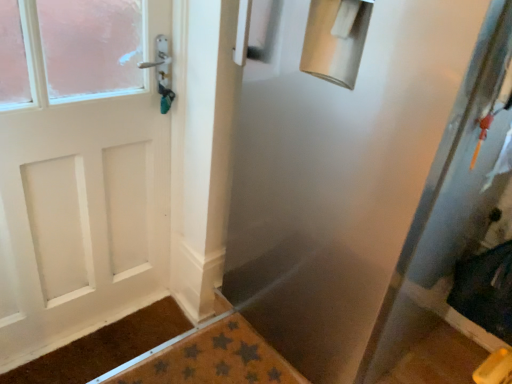
Question: Does transparent plastic screen door at center turn towards brown textured bath mat at lower center?

Choices:
 (A) no
 (B) yes

Answer: (A)

Question: From a real-world perspective, is transparent plastic screen door at center under brown textured bath mat at lower center?

Choices:
 (A) yes
 (B) no

Answer: (B)

Question: Is transparent plastic screen door at center in front of brown textured bath mat at lower center?

Choices:
 (A) no
 (B) yes

Answer: (B)

Question: Does transparent plastic screen door at center have a larger size compared to brown textured bath mat at lower center?

Choices:
 (A) no
 (B) yes

Answer: (B)

Question: Can you confirm if transparent plastic screen door at center is taller than brown textured bath mat at lower center?

Choices:
 (A) no
 (B) yes

Answer: (B)

Question: Considering the relative positions of transparent plastic screen door at center and brown textured mat at lower left in the image provided, is transparent plastic screen door at center to the left or to the right of brown textured mat at lower left?

Choices:
 (A) right
 (B) left

Answer: (A)

Question: Which is correct: transparent plastic screen door at center is inside brown textured mat at lower left, or outside of it?

Choices:
 (A) outside
 (B) inside

Answer: (A)

Question: Is transparent plastic screen door at center wider or thinner than brown textured mat at lower left?

Choices:
 (A) wide
 (B) thin

Answer: (A)

Question: Does point (305, 233) appear closer or farther from the camera than point (106, 359)?

Choices:
 (A) closer
 (B) farther

Answer: (A)

Question: Considering the positions of point (117, 357) and point (291, 374), is point (117, 357) closer or farther from the camera than point (291, 374)?

Choices:
 (A) closer
 (B) farther

Answer: (B)

Question: From a real-world perspective, is brown textured mat at lower left positioned above or below brown textured bath mat at lower center?

Choices:
 (A) above
 (B) below

Answer: (B)

Question: In terms of size, does brown textured mat at lower left appear bigger or smaller than brown textured bath mat at lower center?

Choices:
 (A) small
 (B) big

Answer: (A)

Question: In the image, is brown textured mat at lower left on the left side or the right side of brown textured bath mat at lower center?

Choices:
 (A) right
 (B) left

Answer: (B)

Question: Looking at their shapes, would you say transparent plastic screen door at center is wider or thinner than brown textured bath mat at lower center?

Choices:
 (A) thin
 (B) wide

Answer: (B)

Question: Considering the relative positions of transparent plastic screen door at center and brown textured bath mat at lower center in the image provided, is transparent plastic screen door at center to the left or to the right of brown textured bath mat at lower center?

Choices:
 (A) right
 (B) left

Answer: (A)